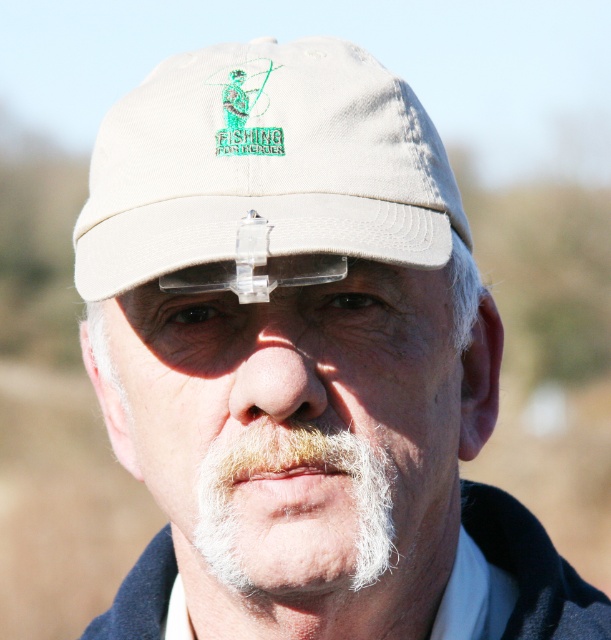
Which is below, beige fabric baseball cap at center or white fuzzy beard at lower center?

white fuzzy beard at lower center is lower down.

Who is more distant from viewer, (384, 221) or (312, 444)?

The point (384, 221) is behind.

Identify the location of beige fabric baseball cap at center. This screenshot has height=640, width=611. (265, 164).